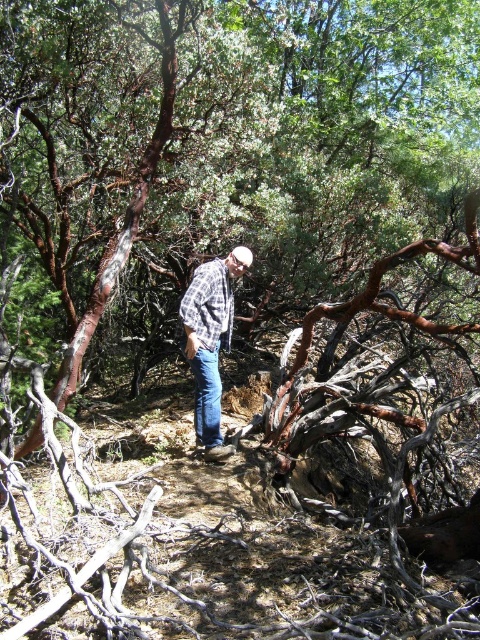
Does brown rough bark tree at center have a lesser height compared to plaid shirt at center?

Incorrect, brown rough bark tree at center's height does not fall short of plaid shirt at center's.

Is brown rough bark tree at center smaller than plaid shirt at center?

Incorrect, brown rough bark tree at center is not smaller in size than plaid shirt at center.

Who is more forward, (467, 122) or (207, 380)?

Point (207, 380)

Identify the location of brown rough bark tree at center. (232, 134).